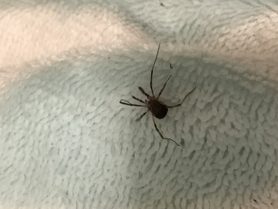
At what (x,y) coordinates should I click in order to perform the action: click on blanket. Please return your answer as a coordinate pair (x, y). Image resolution: width=278 pixels, height=209 pixels. Looking at the image, I should click on (223, 129), (65, 100).